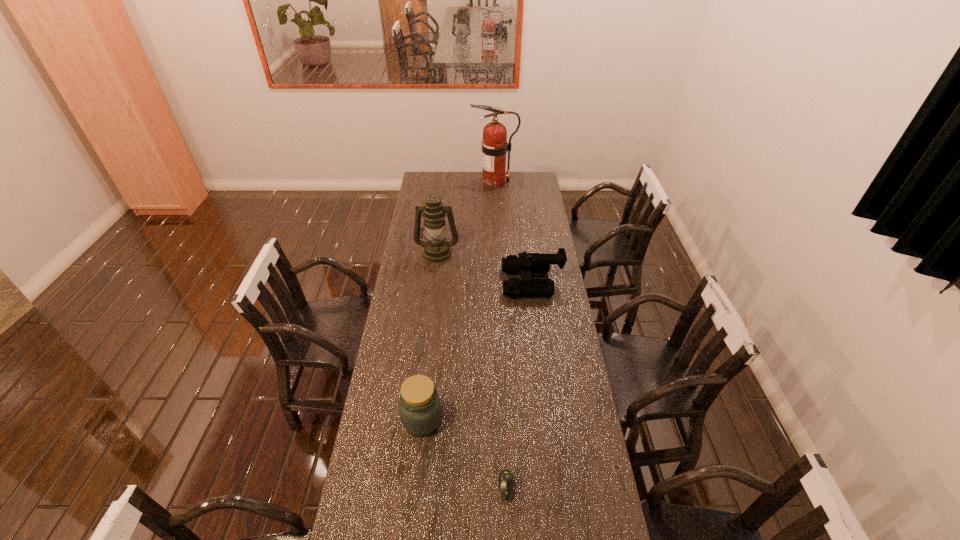
Locate an element on the screen. Image resolution: width=960 pixels, height=540 pixels. the tallest object is located at coordinates (494, 145).

The image size is (960, 540). I want to click on fire extinguisher, so click(494, 145).

This screenshot has width=960, height=540. I want to click on the second tallest object, so click(436, 249).

The image size is (960, 540). I want to click on the fourth nearest object, so click(x=436, y=249).

This screenshot has width=960, height=540. What are the coordinates of `the second nearest object` in the screenshot? It's located at (420, 408).

This screenshot has width=960, height=540. I want to click on the third nearest object, so click(x=527, y=263).

The width and height of the screenshot is (960, 540). I want to click on the nearest object, so click(506, 481).

Find the location of a particular element. computer mouse is located at coordinates (506, 481).

Identify the location of vacant area located 0.310m at the nozzle of the fire extinguisher. This screenshot has width=960, height=540. (420, 182).

Locate an element on the screen. This screenshot has height=540, width=960. vacant region located 0.320m at the nozzle of the fire extinguisher is located at coordinates (419, 182).